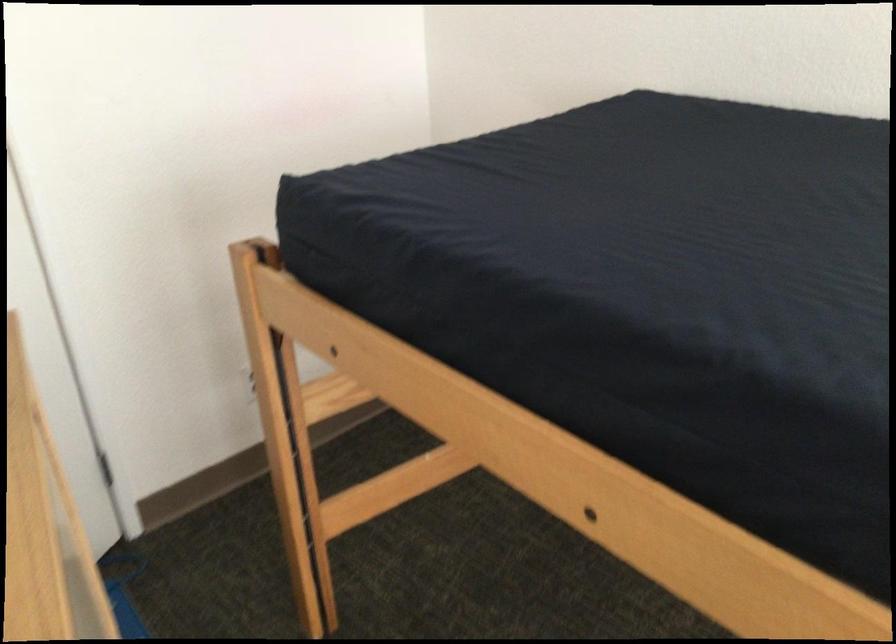
Based on the continuous images, in which direction is the camera rotating?

The camera rotated toward left-down.